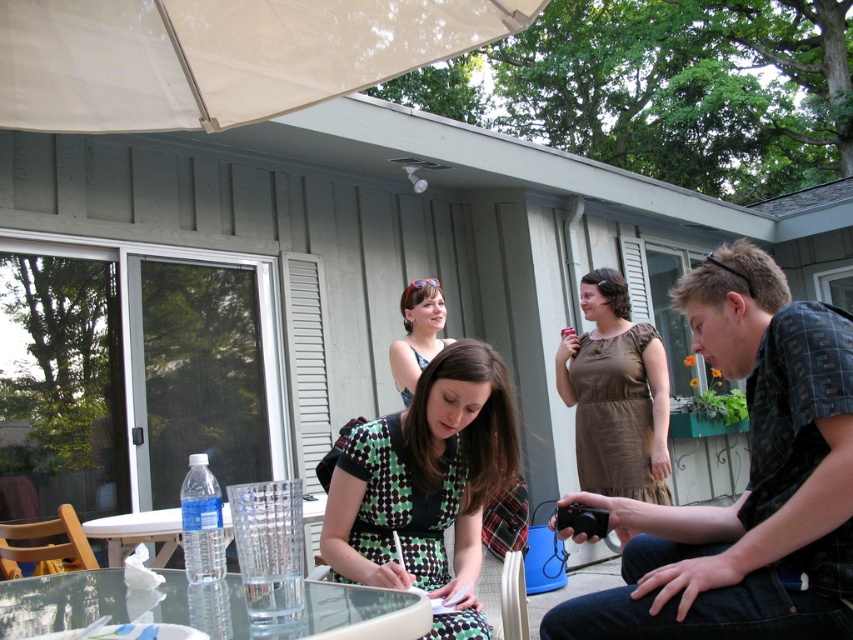
Which is more to the left, patterned fabric shirt at center or matte black tank top at center?

Positioned to the left is matte black tank top at center.

Who is higher up, patterned fabric shirt at center or matte black tank top at center?

matte black tank top at center is above.

This screenshot has height=640, width=853. What do you see at coordinates (747, 483) in the screenshot? I see `patterned fabric shirt at center` at bounding box center [747, 483].

At what (x,y) coordinates should I click in order to perform the action: click on patterned fabric shirt at center. Please return your answer as a coordinate pair (x, y). This screenshot has height=640, width=853. Looking at the image, I should click on (747, 483).

Can you confirm if green checkered dress at center is smaller than matte black tank top at center?

No, green checkered dress at center is not smaller than matte black tank top at center.

Which is more to the left, green checkered dress at center or matte black tank top at center?

matte black tank top at center is more to the left.

Between point (373, 529) and point (403, 348), which one is positioned behind?

The point (403, 348) is behind.

Where is `green checkered dress at center`? This screenshot has width=853, height=640. green checkered dress at center is located at coordinates (426, 484).

Can you confirm if transparent glass table at lower center is thinner than clear glass table at center?

Yes.

Does transparent glass table at lower center come behind clear glass table at center?

That is False.

At what (x,y) coordinates should I click in order to perform the action: click on transparent glass table at lower center. Please return your answer as a coordinate pair (x, y). The image size is (853, 640). Looking at the image, I should click on (61, 602).